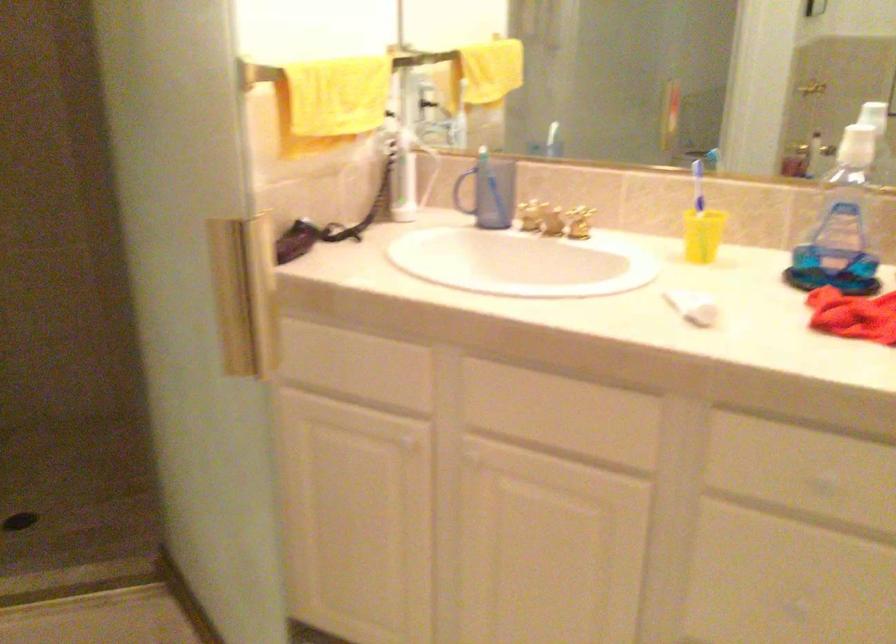
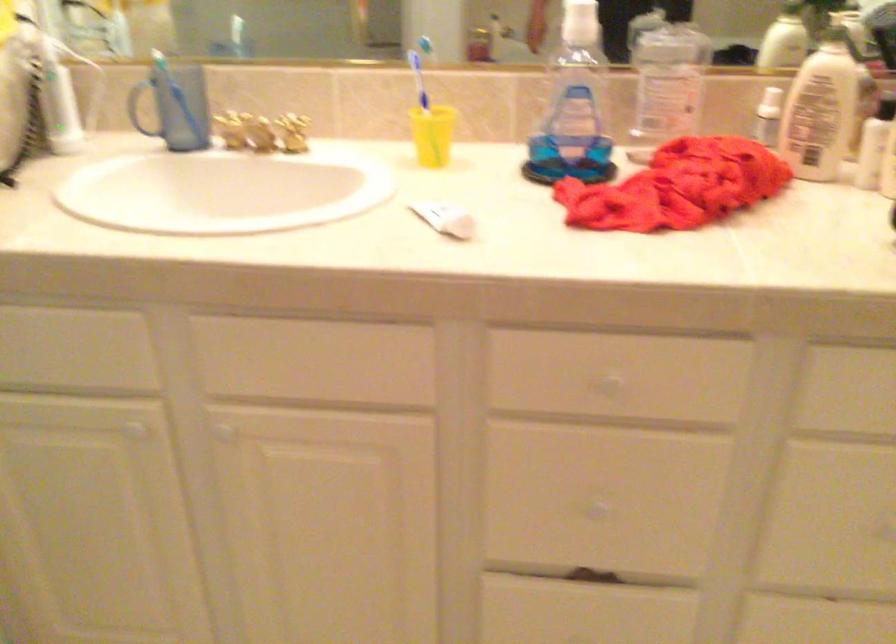
Locate, in the second image, the point that corresponds to (x=690, y=307) in the first image.

(444, 219)